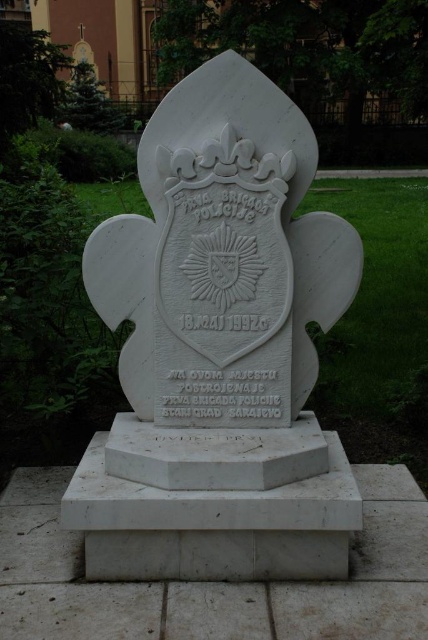
Question: Is white marble monument at center to the left of white marble gravestone at lower center from the viewer's perspective?

Choices:
 (A) no
 (B) yes

Answer: (A)

Question: Does white marble monument at center appear on the left side of white marble gravestone at lower center?

Choices:
 (A) yes
 (B) no

Answer: (B)

Question: Is white marble monument at center above white marble gravestone at lower center?

Choices:
 (A) yes
 (B) no

Answer: (A)

Question: Among these objects, which one is nearest to the camera?

Choices:
 (A) white marble gravestone at lower center
 (B) white marble monument at center

Answer: (A)